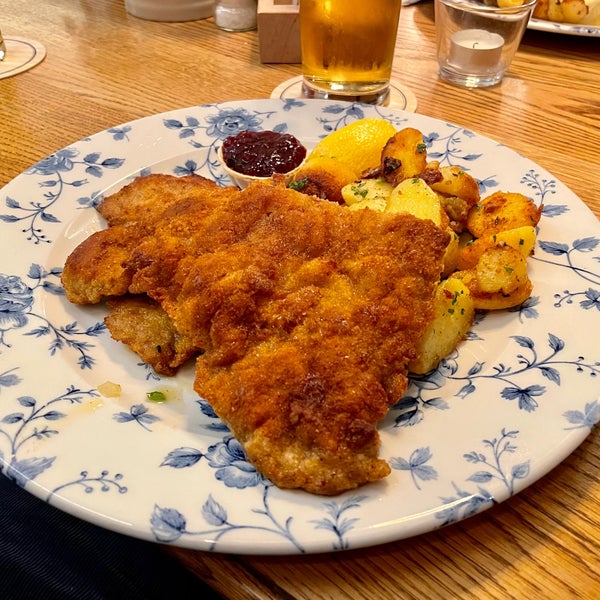
Where is `dark brown lines on table`? dark brown lines on table is located at coordinates pos(280,590), pos(578,110), pos(502,551), pos(458,569).